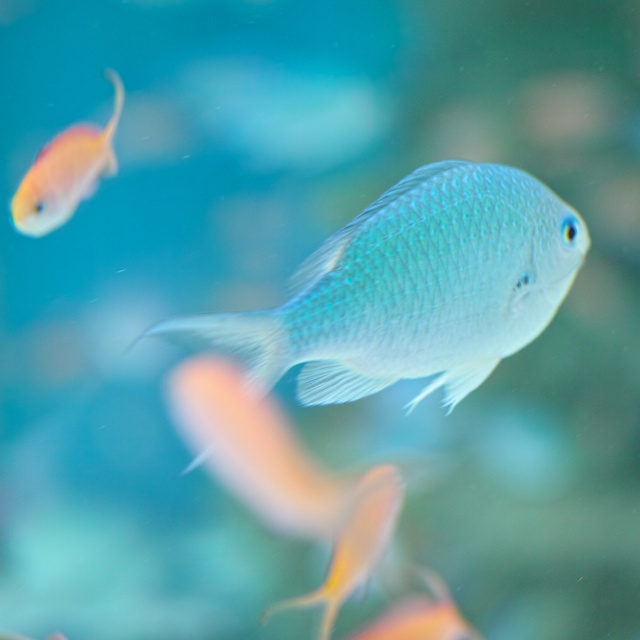
You are a scuba diver observing the underwater scene. You notice two points marked in the image. The first point is at coordinates point (516, 291), and the second is at point (72, 193). Which point is closer to you, the observer?

Point (516, 291) is in front of point (72, 193), so the first point is closer to you.

You are a marine biologist observing an underwater scene. You notice a point at coordinates [413,289]. What object does this point correspond to?

The point at coordinates [413,289] corresponds to the shiny blue fish at center.